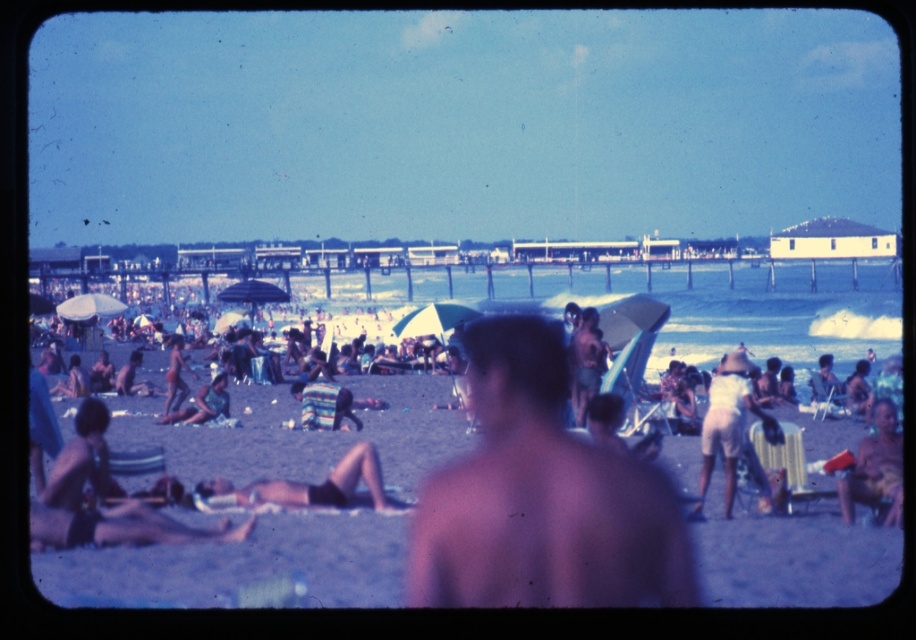
You are standing at the point closest to the camera in this beach scene. Which point, point (346, 472) or point (177, 406), is closer to the ocean?

Point (177, 406) is closer to the ocean because it is behind point (346, 472), which is in front of it.

You are a photographer trying to capture the tan skin person at center and the matte black bikini at center in the same frame. Which object is positioned lower in the image?

→ The matte black bikini at center is located below the tan skin person at center, so it is positioned lower in the image.

You are a photographer trying to capture a shot of the matte black bikini at center without the matte white umbrella at center blocking the view. Can you move closer to the bikini to ensure it is fully visible in your photo?

The matte white umbrella at center is closer to the viewer than the matte black bikini at center, so moving closer to the bikini may not be possible as the umbrella is in front. To avoid the umbrella blocking the view, you would need to adjust your angle or position behind the umbrella.